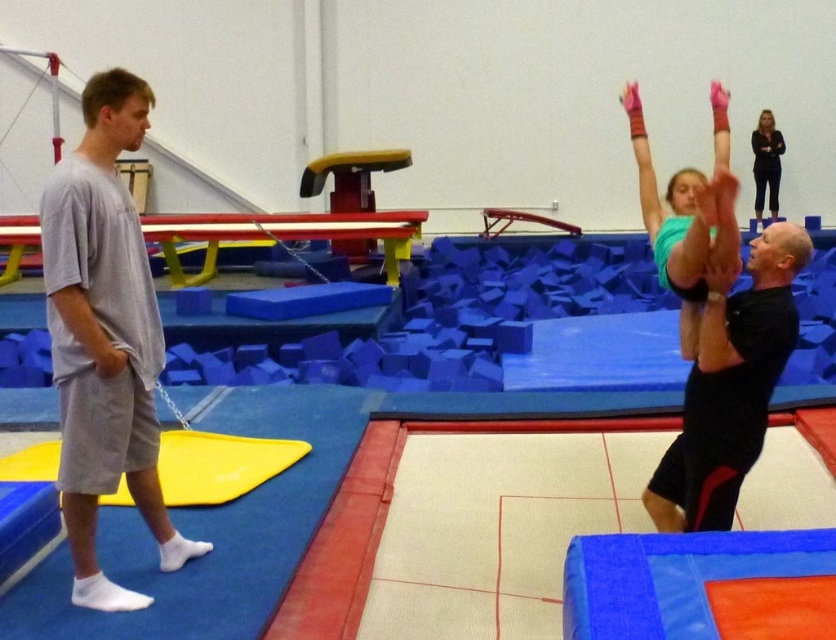
You are a gymnast in the gym and you see the black matte shirt at upper right and the gray cotton shirt at left. Which one is positioned more to the right side of the gym?

The black matte shirt at upper right is positioned more to the right side of the gym than the gray cotton shirt at left.

You are a gymnast standing at the center of the gym. You need to locate the black matte shirt at upper right. Based on the coordinates provided, in which direction should you look to find it?

The black matte shirt at upper right is located at coordinates point (x=727, y=384), so you should look to the upper right direction to find it.

You are a gymnast in the gymnasium and need to locate your coach. According to the image, where is the gray cotton shirt at left located in the scene?

The gray cotton shirt at left is located at point (88, 330) in the scene.